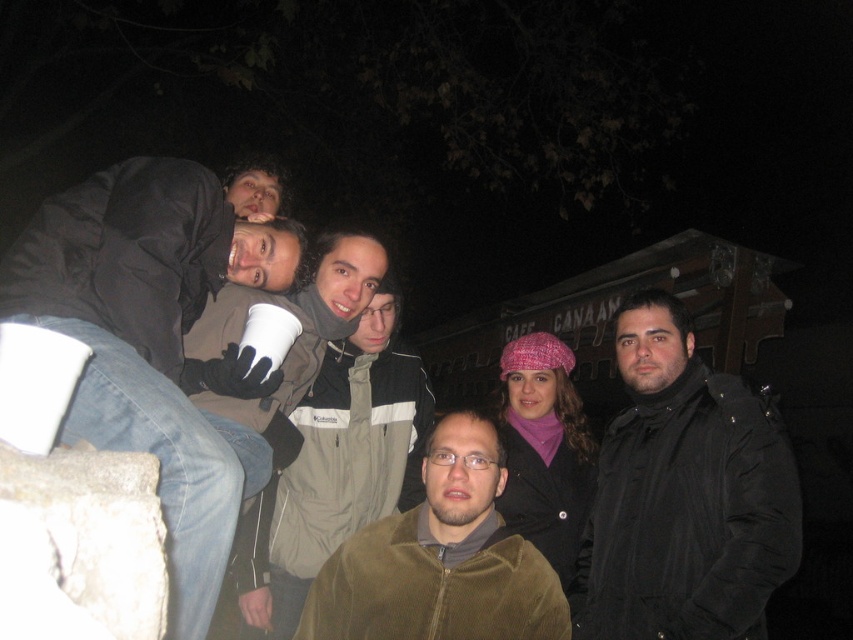
You are standing in the Canaan area at night and see a group of people. There is a point marked at coordinates (x=157, y=342). What object is located at this point?

The point at coordinates (x=157, y=342) indicates a white paper cup at upper left.

Please look at the image and tell me the exact 2D coordinates of the white paper cup at upper left in the form of a point like this example format, such as point 0.5,0.5. The coordinate system is normalized, where the origin is at the bottom left corner of the image, and the x and y axes increase to the right and upward respectively. The maximum x and y values are both 1.0. Please answer with only the point coordinates in the format point followed by the coordinates. For example, point 0.5,0.5. Do not add a

point [157,342]